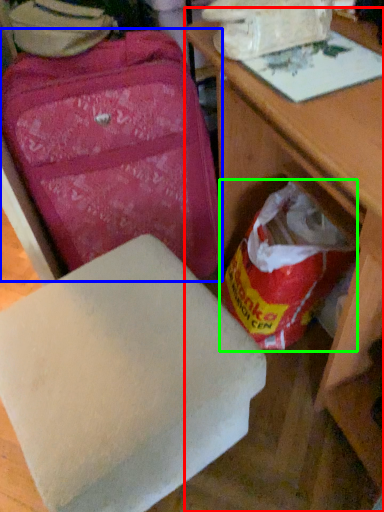
Question: Which object is positioned closest to table (highlighted by a red box)? Select from suitcase (highlighted by a blue box) and grocery bag (highlighted by a green box).

Choices:
 (A) suitcase
 (B) grocery bag

Answer: (B)